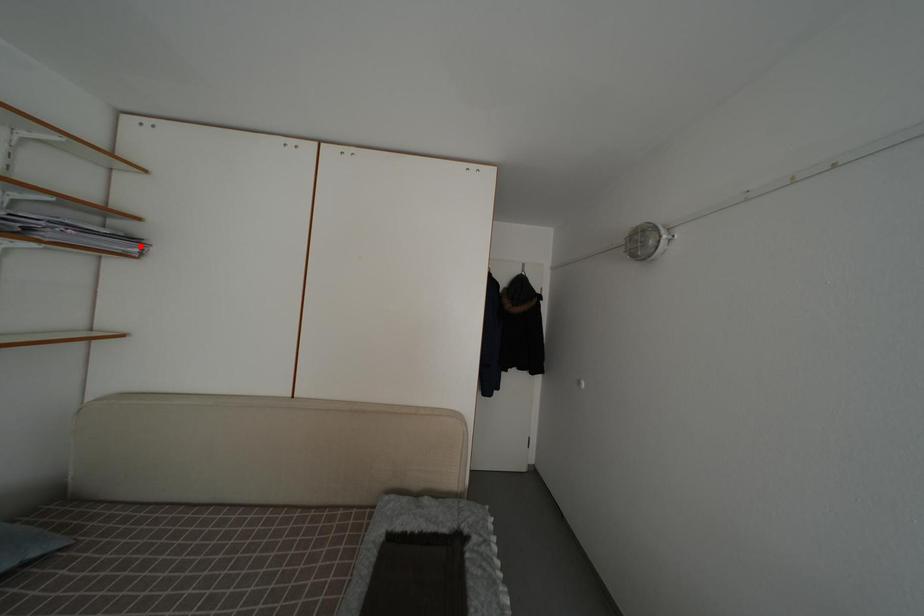
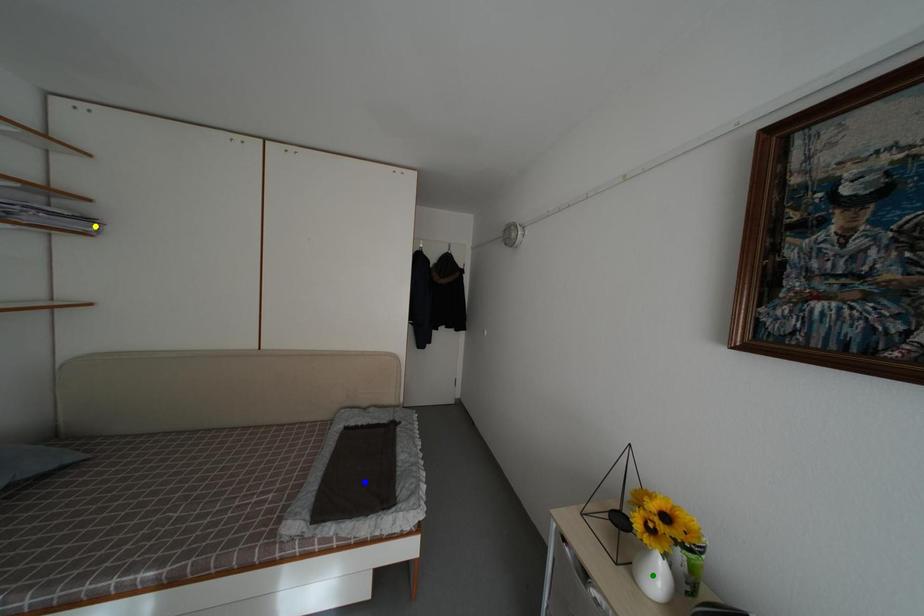
Question: I am providing you with two images of the same scene from different viewpoints. A red point is marked on the first image. You are given multiple points on the second image. In image 2, which mark is for the same physical point as the one in image 1?

Choices:
 (A) blue point
 (B) green point
 (C) yellow point

Answer: (C)